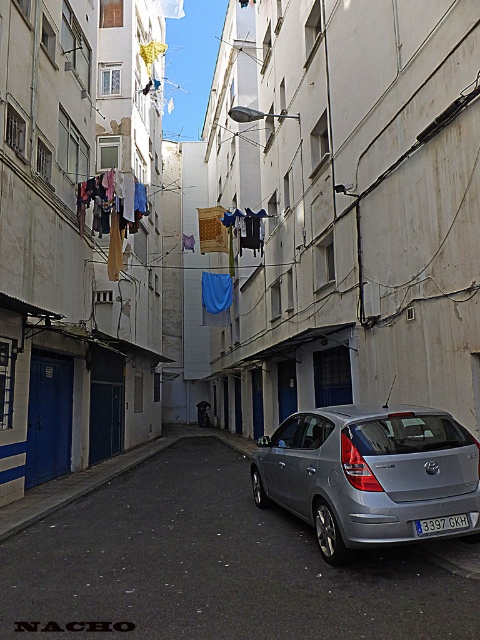
Does silver metallic car at center have a greater width compared to satin silver hatchback at center?

Yes, silver metallic car at center is wider than satin silver hatchback at center.

Can you confirm if silver metallic car at center is smaller than satin silver hatchback at center?

Incorrect, silver metallic car at center is not smaller in size than satin silver hatchback at center.

Who is more distant from viewer, (177,492) or (300,461)?

Answer: Point (177,492)

Identify the location of silver metallic car at center. (x=219, y=566).

Is satin silver hatchback at center further to the viewer compared to blue metallic license plate at center?

No, satin silver hatchback at center is closer to the viewer.

Can you confirm if satin silver hatchback at center is thinner than blue metallic license plate at center?

In fact, satin silver hatchback at center might be wider than blue metallic license plate at center.

Does point (392, 532) lie behind point (432, 525)?

That is False.

The height and width of the screenshot is (640, 480). In order to click on satin silver hatchback at center in this screenshot , I will do `click(369, 474)`.

Is silver metallic car at center in front of blue metallic license plate at center?

Yes, it is.

Does silver metallic car at center appear over blue metallic license plate at center?

Actually, silver metallic car at center is below blue metallic license plate at center.

Locate an element on the screen. This screenshot has height=640, width=480. silver metallic car at center is located at coordinates (219, 566).